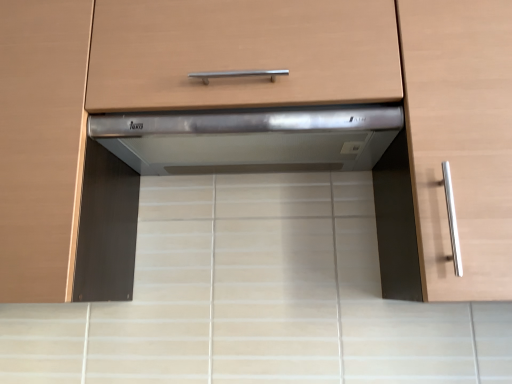
Question: Would you say satin silver range hood at center is outside satin silver drawer at center?

Choices:
 (A) yes
 (B) no

Answer: (A)

Question: Is satin silver range hood at center smaller than satin silver drawer at center?

Choices:
 (A) no
 (B) yes

Answer: (B)

Question: Is the depth of satin silver range hood at center less than that of satin silver drawer at center?

Choices:
 (A) yes
 (B) no

Answer: (B)

Question: From the image's perspective, is satin silver range hood at center on top of satin silver drawer at center?

Choices:
 (A) no
 (B) yes

Answer: (A)

Question: Is satin silver drawer at center at the back of satin silver range hood at center?

Choices:
 (A) no
 (B) yes

Answer: (A)

Question: Does satin silver range hood at center have a greater height compared to satin silver drawer at center?

Choices:
 (A) yes
 (B) no

Answer: (B)

Question: From the image's perspective, would you say satin silver drawer at center is positioned over satin silver range hood at center?

Choices:
 (A) no
 (B) yes

Answer: (B)

Question: Considering the relative sizes of satin silver drawer at center and satin silver range hood at center in the image provided, is satin silver drawer at center thinner than satin silver range hood at center?

Choices:
 (A) yes
 (B) no

Answer: (B)

Question: Does satin silver drawer at center appear on the left side of satin silver range hood at center?

Choices:
 (A) yes
 (B) no

Answer: (A)

Question: From the image's perspective, is satin silver drawer at center beneath satin silver range hood at center?

Choices:
 (A) no
 (B) yes

Answer: (A)

Question: Is satin silver drawer at center not close to satin silver range hood at center?

Choices:
 (A) no
 (B) yes

Answer: (A)

Question: Can you confirm if satin silver drawer at center is taller than satin silver range hood at center?

Choices:
 (A) no
 (B) yes

Answer: (B)

Question: Is satin silver drawer at center not within satin wood cabinet handle at right, the 1th cabinetry when ordered from right to left?

Choices:
 (A) yes
 (B) no

Answer: (A)